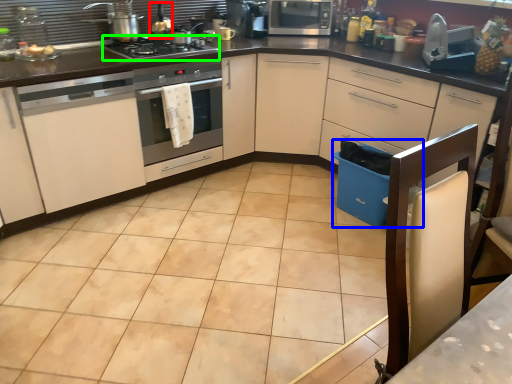
Question: Which object is positioned farthest from appliance (highlighted by a red box)? Select from dish washer (highlighted by a blue box) and gas stove (highlighted by a green box).

Choices:
 (A) dish washer
 (B) gas stove

Answer: (A)